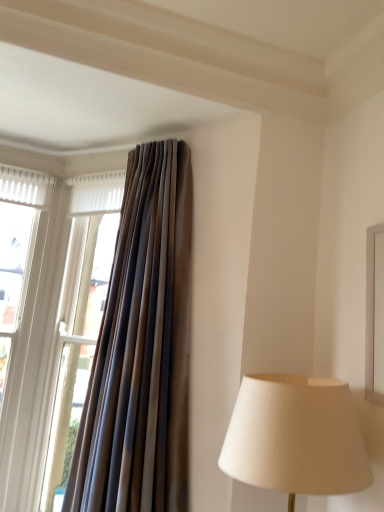
Question: Is the depth of matte brown curtain at left greater than that of brown textured curtain at upper left?

Choices:
 (A) no
 (B) yes

Answer: (B)

Question: Does matte brown curtain at left have a lesser width compared to brown textured curtain at upper left?

Choices:
 (A) yes
 (B) no

Answer: (A)

Question: Is matte brown curtain at left directly adjacent to brown textured curtain at upper left?

Choices:
 (A) no
 (B) yes

Answer: (A)

Question: From a real-world perspective, is matte brown curtain at left positioned under brown textured curtain at upper left based on gravity?

Choices:
 (A) yes
 (B) no

Answer: (A)

Question: Is matte brown curtain at left outside brown textured curtain at upper left?

Choices:
 (A) yes
 (B) no

Answer: (A)

Question: Is matte brown curtain at left oriented towards brown textured curtain at upper left?

Choices:
 (A) no
 (B) yes

Answer: (A)

Question: Can you confirm if brown textured curtain at upper left is smaller than matte brown curtain at left?

Choices:
 (A) yes
 (B) no

Answer: (B)

Question: Is brown textured curtain at upper left at the left side of matte brown curtain at left?

Choices:
 (A) no
 (B) yes

Answer: (A)

Question: Is brown textured curtain at upper left facing towards matte brown curtain at left?

Choices:
 (A) no
 (B) yes

Answer: (A)

Question: Is brown textured curtain at upper left wider than matte brown curtain at left?

Choices:
 (A) no
 (B) yes

Answer: (B)

Question: Are brown textured curtain at upper left and matte brown curtain at left making contact?

Choices:
 (A) yes
 (B) no

Answer: (B)

Question: From the image's perspective, is brown textured curtain at upper left over matte brown curtain at left?

Choices:
 (A) yes
 (B) no

Answer: (A)

Question: Does point (185, 301) appear closer or farther from the camera than point (107, 245)?

Choices:
 (A) closer
 (B) farther

Answer: (A)